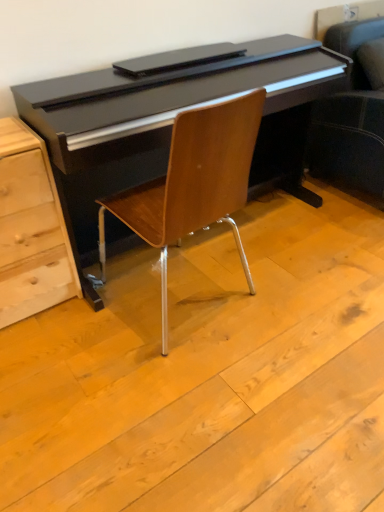
Locate an element on the screen. vacant space situated on the left part of woodenchair at center is located at coordinates (67, 336).